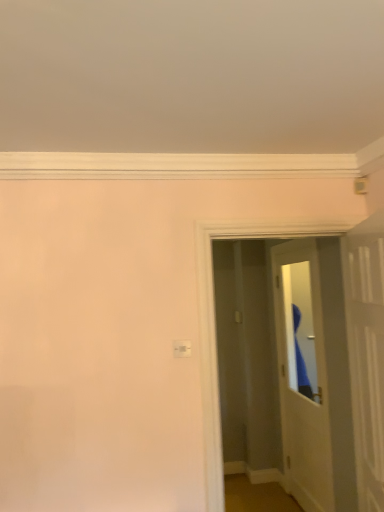
Question: Is the surface of white glossy door at center, acting as the 2th door starting from the front, in direct contact with white glossy door at upper right, which is the 2th door in back-to-front order?

Choices:
 (A) no
 (B) yes

Answer: (A)

Question: Is white glossy door at center, acting as the 2th door starting from the front, looking in the opposite direction of white glossy door at upper right, which is the 2th door in back-to-front order?

Choices:
 (A) no
 (B) yes

Answer: (A)

Question: Is white glossy door at center, positioned as the first door in back-to-front order, facing towards white glossy door at upper right, which is the 2th door in back-to-front order?

Choices:
 (A) yes
 (B) no

Answer: (B)

Question: Does white glossy door at center, positioned as the first door in back-to-front order, come behind white glossy door at upper right, the 1th door viewed from the front?

Choices:
 (A) no
 (B) yes

Answer: (B)

Question: Is the position of white glossy door at center, positioned as the first door in back-to-front order, less distant than that of white glossy door at upper right, which is the 2th door in back-to-front order?

Choices:
 (A) no
 (B) yes

Answer: (A)

Question: Is white glossy door at center, positioned as the first door in back-to-front order, taller than white glossy door at upper right, which is the 2th door in back-to-front order?

Choices:
 (A) yes
 (B) no

Answer: (A)

Question: Is white glossy door at upper right, which is the 2th door in back-to-front order, not within white glossy door at center, positioned as the first door in back-to-front order?

Choices:
 (A) yes
 (B) no

Answer: (A)

Question: Is white glossy door at upper right, the 1th door viewed from the front, smaller than white glossy door at center, acting as the 2th door starting from the front?

Choices:
 (A) yes
 (B) no

Answer: (A)

Question: Would you say white glossy door at center, positioned as the first door in back-to-front order, is part of white glossy door at upper right, the 1th door viewed from the front,'s contents?

Choices:
 (A) no
 (B) yes

Answer: (A)

Question: Is white glossy door at upper right, which is the 2th door in back-to-front order, directly adjacent to white glossy door at center, acting as the 2th door starting from the front?

Choices:
 (A) no
 (B) yes

Answer: (A)

Question: Can you confirm if white glossy door at upper right, the 1th door viewed from the front, is bigger than white glossy door at center, positioned as the first door in back-to-front order?

Choices:
 (A) no
 (B) yes

Answer: (A)

Question: Is white glossy door at upper right, the 1th door viewed from the front, positioned far away from white glossy door at center, acting as the 2th door starting from the front?

Choices:
 (A) yes
 (B) no

Answer: (A)

Question: Looking at their shapes, would you say white glossy door at upper right, the 1th door viewed from the front, is wider or thinner than white glossy door at center, acting as the 2th door starting from the front?

Choices:
 (A) thin
 (B) wide

Answer: (B)